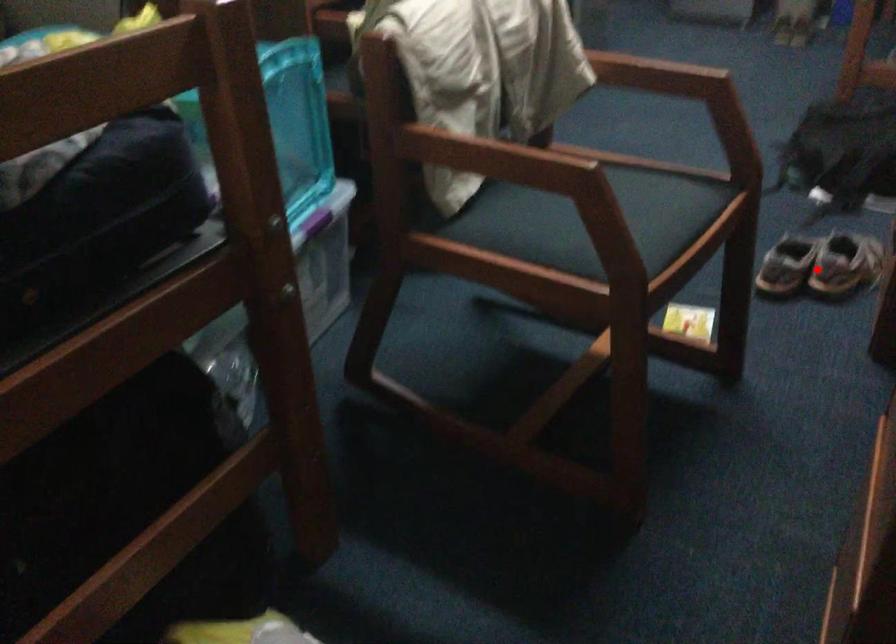
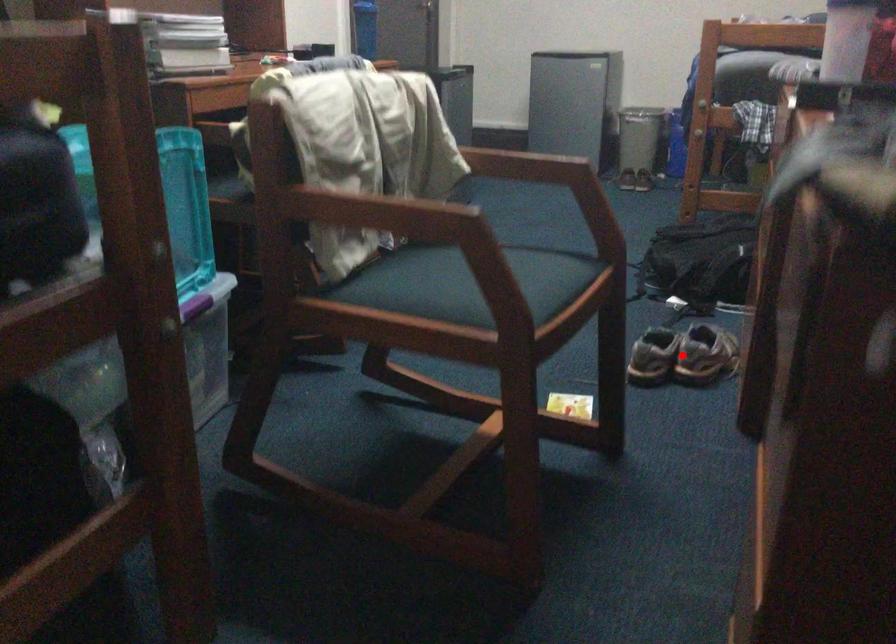
I am providing you with two images of the same scene from different viewpoints. A red point is marked on the first image and another point is marked on the second image. Are the points marked in image1 and image2 representing the same 3D position?

Yes